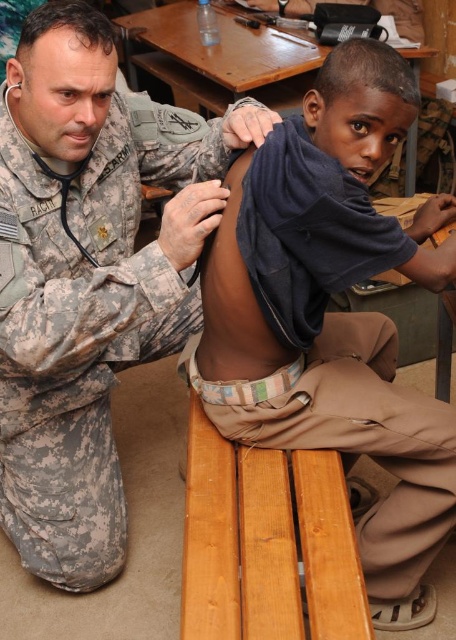
Question: Can you confirm if dark blue fabric at upper center is positioned below wooden picnic table at upper center?

Choices:
 (A) yes
 (B) no

Answer: (A)

Question: Does camouflage uniform at lower left have a greater width compared to wooden picnic table at upper center?

Choices:
 (A) yes
 (B) no

Answer: (B)

Question: Which point is farther to the camera?

Choices:
 (A) dark blue fabric at upper center
 (B) wooden picnic table at upper center

Answer: (B)

Question: Which object is the closest to the wooden picnic table at upper center?

Choices:
 (A) dark blue fabric at upper center
 (B) camouflage uniform at lower left

Answer: (B)

Question: Can you confirm if dark blue fabric at upper center is positioned above wooden picnic table at upper center?

Choices:
 (A) no
 (B) yes

Answer: (A)

Question: Which point is farther from the camera taking this photo?

Choices:
 (A) (342, 272)
 (B) (115, 266)
 (C) (217, 81)

Answer: (C)